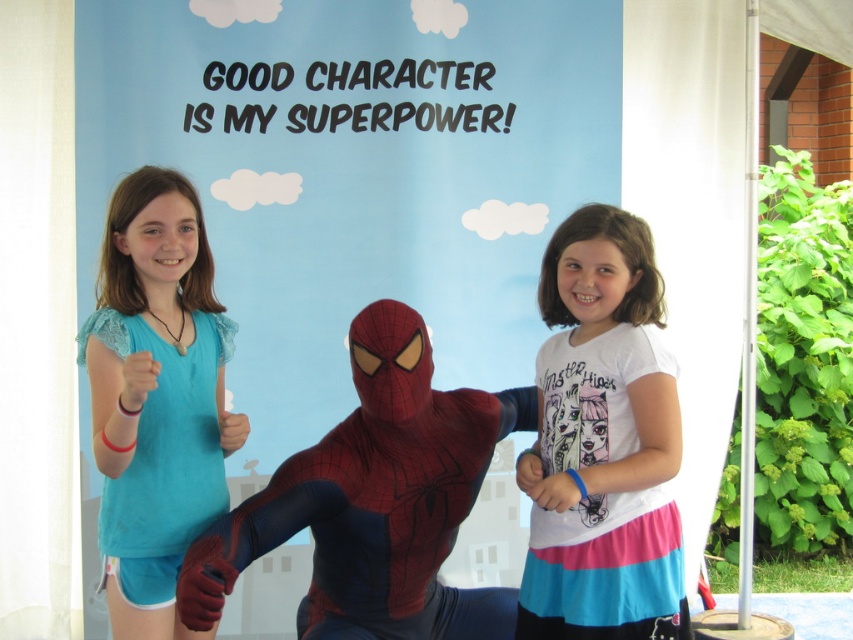
Does shiny spandex suit at center come behind matte blue shirt at left?

No, it is in front of matte blue shirt at left.

This screenshot has width=853, height=640. What do you see at coordinates (375, 500) in the screenshot? I see `shiny spandex suit at center` at bounding box center [375, 500].

Is point (456, 616) farther from camera compared to point (184, 348)?

Yes.

Where is `shiny spandex suit at center`? shiny spandex suit at center is located at coordinates (375, 500).

Does blue paper at center appear under white cotton shirt at center?

Actually, blue paper at center is above white cotton shirt at center.

Describe the element at coordinates (355, 173) in the screenshot. This screenshot has height=640, width=853. I see `blue paper at center` at that location.

Where is `blue paper at center`? blue paper at center is located at coordinates (355, 173).

Is the position of shiny spandex suit at center more distant than that of white cotton shirt at center?

That is False.

Which is more to the left, shiny spandex suit at center or white cotton shirt at center?

shiny spandex suit at center

Is point (430, 410) positioned in front of point (642, 449)?

No, (430, 410) is further to viewer.

Where is `shiny spandex suit at center`? shiny spandex suit at center is located at coordinates (375, 500).